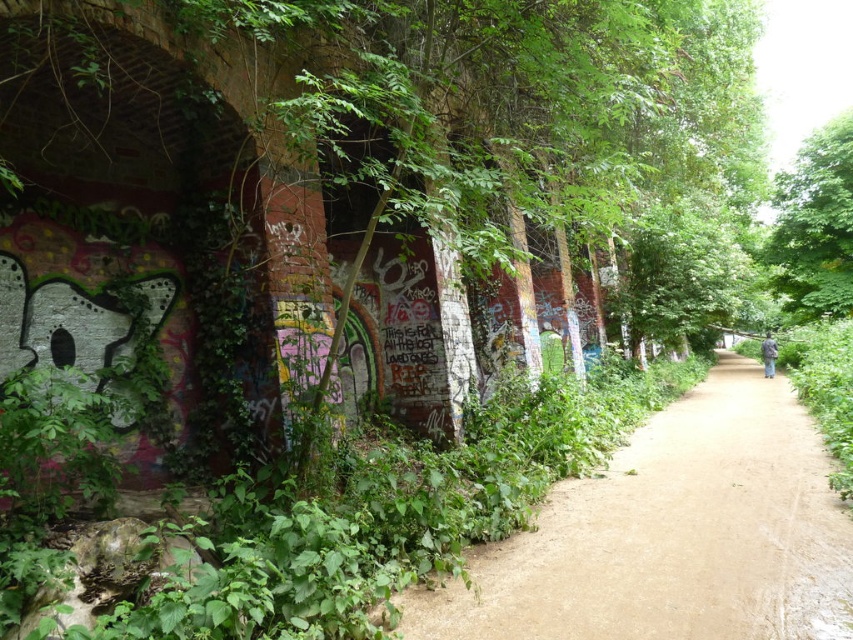
Question: Which of the following is the farthest from the observer?

Choices:
 (A) green leafy tree at upper right
 (B) brown dirt path at center

Answer: (A)

Question: Is brown dirt path at center below green leafy tree at upper right?

Choices:
 (A) yes
 (B) no

Answer: (A)

Question: From the image, what is the correct spatial relationship of brown dirt path at center in relation to green leafy tree at upper right?

Choices:
 (A) above
 (B) below

Answer: (B)

Question: Among these points, which one is nearest to the camera?

Choices:
 (A) (x=604, y=529)
 (B) (x=807, y=227)

Answer: (A)

Question: Can you confirm if brown dirt path at center is bigger than green leafy tree at upper right?

Choices:
 (A) no
 (B) yes

Answer: (A)

Question: Among these points, which one is farthest from the camera?

Choices:
 (A) (544, 518)
 (B) (793, 275)

Answer: (B)